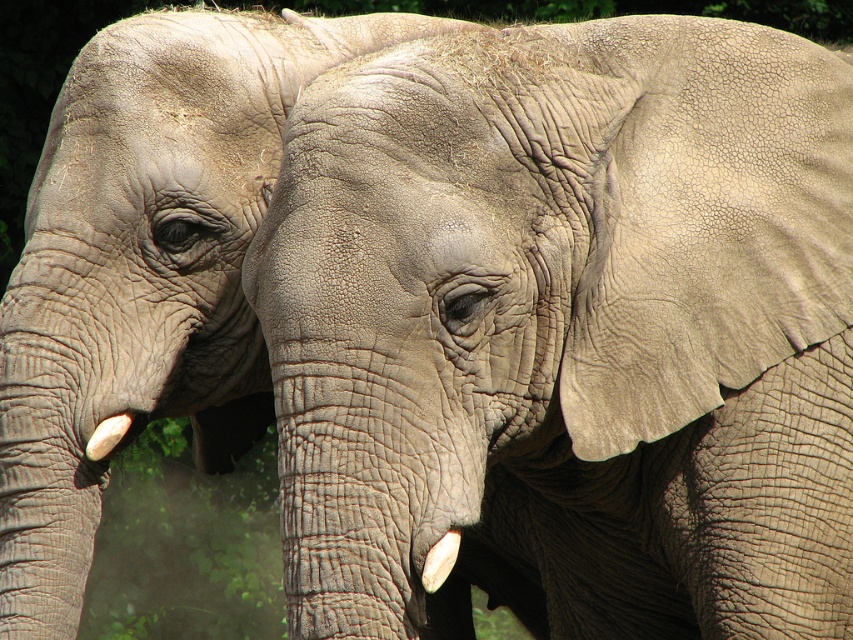
Which is more to the right, gray textured elephant at center or white matte tusk at lower center?

gray textured elephant at center is more to the right.

You are a GUI agent. You are given a task and a screenshot of the screen. Output one action in this format:
    pyautogui.click(x=<x>, y=<y>)
    Task: Click on the gray textured elephant at center
    The height and width of the screenshot is (640, 853).
    Given the screenshot: What is the action you would take?
    pyautogui.click(x=569, y=324)

Based on the photo, measure the distance from gray textured elephant at center to white ivory tusk at lower left.

They are 34.70 inches apart.

Does point (592, 554) come closer to viewer compared to point (120, 438)?

No, (592, 554) is behind (120, 438).

Is point (602, 358) farther from camera compared to point (90, 448)?

No, (602, 358) is closer to viewer.

You are a GUI agent. You are given a task and a screenshot of the screen. Output one action in this format:
    pyautogui.click(x=<x>, y=<y>)
    Task: Click on the gray textured elephant at center
    Image resolution: width=853 pixels, height=640 pixels.
    Given the screenshot: What is the action you would take?
    pyautogui.click(x=569, y=324)

Does point (430, 573) come closer to viewer compared to point (85, 452)?

Yes, point (430, 573) is in front of point (85, 452).

Who is more distant from viewer, (451, 545) or (91, 449)?

The point (91, 449) is behind.

Which is in front, point (444, 545) or point (103, 429)?

Point (444, 545) is more forward.

The width and height of the screenshot is (853, 640). Identify the location of white matte tusk at lower center. (440, 561).